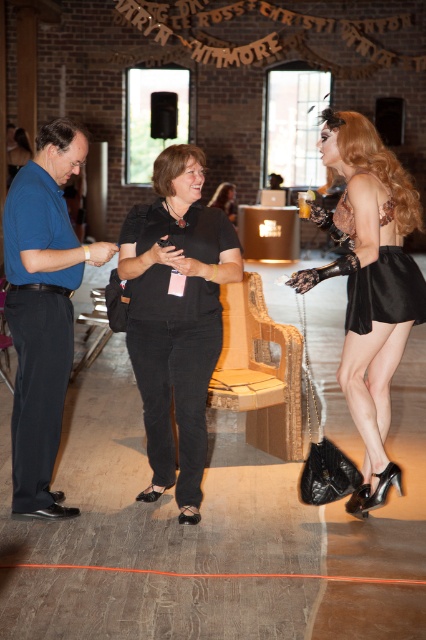
Can you confirm if black matte/black pants at center is thinner than blue smooth shirt at center?

In fact, black matte/black pants at center might be wider than blue smooth shirt at center.

This screenshot has width=426, height=640. Find the location of `black matte/black pants at center`. black matte/black pants at center is located at coordinates (175, 316).

The height and width of the screenshot is (640, 426). Describe the element at coordinates (175, 316) in the screenshot. I see `black matte/black pants at center` at that location.

Does black matte/black pants at center appear on the right side of black satin dress at right?

In fact, black matte/black pants at center is to the left of black satin dress at right.

This screenshot has width=426, height=640. I want to click on black matte/black pants at center, so click(x=175, y=316).

The width and height of the screenshot is (426, 640). What are the coordinates of `black matte/black pants at center` in the screenshot? It's located at (175, 316).

Can you confirm if velvet black dress at right is thinner than black satin dress at right?

No, velvet black dress at right is not thinner than black satin dress at right.

Does velvet black dress at right have a greater width compared to black satin dress at right?

Correct, the width of velvet black dress at right exceeds that of black satin dress at right.

Between point (389, 476) and point (393, 268), which one is positioned behind?

Positioned behind is point (389, 476).

This screenshot has width=426, height=640. Identify the location of velvet black dress at right. (370, 284).